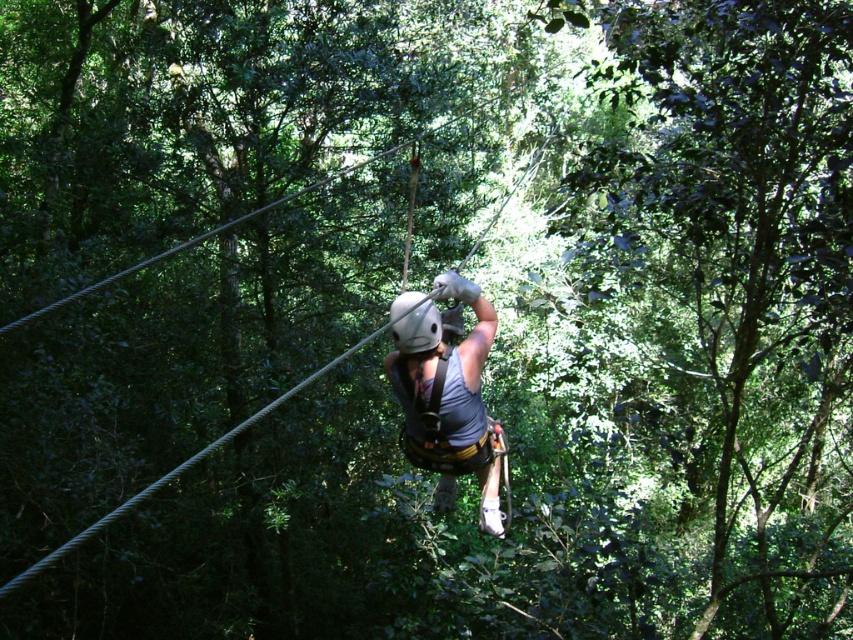
Question: Is green leafy tree at center below gray fabric harness at center?

Choices:
 (A) no
 (B) yes

Answer: (A)

Question: Where is green leafy tree at center located in relation to gray fabric harness at center in the image?

Choices:
 (A) left
 (B) right

Answer: (B)

Question: Among these objects, which one is nearest to the camera?

Choices:
 (A) gray fabric harness at center
 (B) green leafy tree at center

Answer: (A)

Question: Observing the image, what is the correct spatial positioning of green leafy tree at center in reference to gray fabric harness at center?

Choices:
 (A) above
 (B) below

Answer: (A)